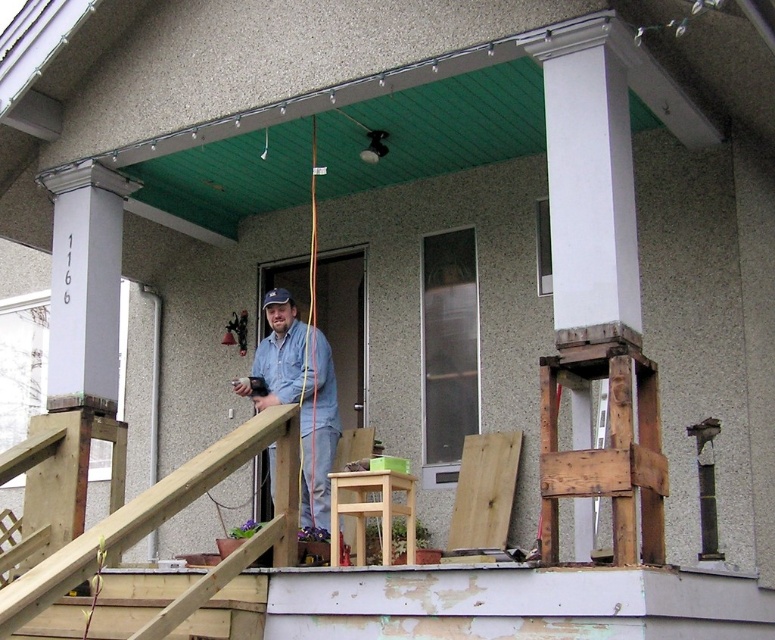
You are standing on the porch and want to sit down. You see a light brown wood chair at center and a light brown wooden stool at center. Which one is to your left?

The light brown wooden stool at center is to the left of the light brown wood chair at center.

You are standing on the porch of the house with the number 1166. You need to reach a point that is exactly at coordinates (x=274, y=486). Considering the items on the porch such as the wooden planks, the small wooden table, and the potted plants, can you safely step on any of these items to get closer to that point without moving the man who is holding something in his hands?

The distance of point (x=274, y=486) from viewer is 6.37 meters. Since the items like wooden planks, small wooden table, and potted plants are on the porch, you can step on them to get closer to the point as long as they are stable and not obstructed by the man.